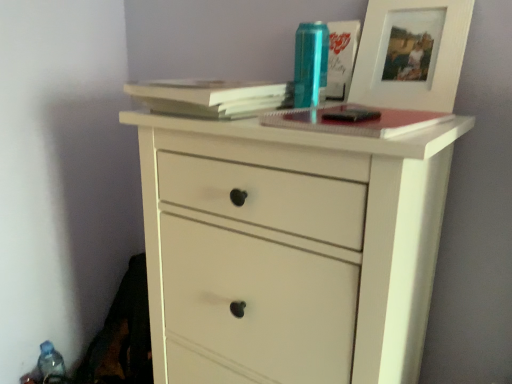
Question: Is light brown paper at upper center, positioned as the 2th paperback book in right-to-left order, not within white matte chest of drawers at center?

Choices:
 (A) no
 (B) yes

Answer: (B)

Question: Can you confirm if light brown paper at upper center, positioned as the 1th paperback book in left-to-right order, is smaller than white matte chest of drawers at center?

Choices:
 (A) yes
 (B) no

Answer: (A)

Question: Is light brown paper at upper center, positioned as the 2th paperback book in right-to-left order, at the right side of white matte chest of drawers at center?

Choices:
 (A) yes
 (B) no

Answer: (B)

Question: From the image's perspective, is light brown paper at upper center, positioned as the 1th paperback book in left-to-right order, located above white matte chest of drawers at center?

Choices:
 (A) yes
 (B) no

Answer: (A)

Question: Considering the relative sizes of light brown paper at upper center, positioned as the 2th paperback book in right-to-left order, and white matte chest of drawers at center in the image provided, is light brown paper at upper center, positioned as the 2th paperback book in right-to-left order, thinner than white matte chest of drawers at center?

Choices:
 (A) no
 (B) yes

Answer: (B)

Question: From the image's perspective, is white matte chest of drawers at center positioned above or below hardcover notebook at center, the first paperback book from the right?

Choices:
 (A) below
 (B) above

Answer: (A)

Question: From a real-world perspective, is white matte chest of drawers at center positioned above or below hardcover notebook at center, the first paperback book from the right?

Choices:
 (A) above
 (B) below

Answer: (B)

Question: Considering the positions of white matte chest of drawers at center and hardcover notebook at center, which ranks as the 2th paperback book in left-to-right order, in the image, is white matte chest of drawers at center wider or thinner than hardcover notebook at center, which ranks as the 2th paperback book in left-to-right order,?

Choices:
 (A) thin
 (B) wide

Answer: (B)

Question: In the image, is white matte chest of drawers at center on the left side or the right side of hardcover notebook at center, which ranks as the 2th paperback book in left-to-right order?

Choices:
 (A) left
 (B) right

Answer: (A)

Question: From the image's perspective, is light brown paper at upper center, positioned as the 2th paperback book in right-to-left order, above or below blue plastic bottle at lower left, placed as the 2th bottle when sorted from top to bottom?

Choices:
 (A) below
 (B) above

Answer: (B)

Question: In the image, is light brown paper at upper center, positioned as the 2th paperback book in right-to-left order, positioned in front of or behind blue plastic bottle at lower left, the first bottle from the left?

Choices:
 (A) behind
 (B) front

Answer: (B)

Question: Looking at the image, does light brown paper at upper center, positioned as the 2th paperback book in right-to-left order, seem bigger or smaller compared to blue plastic bottle at lower left, placed as the 2th bottle when sorted from top to bottom?

Choices:
 (A) big
 (B) small

Answer: (A)

Question: Would you say light brown paper at upper center, positioned as the 1th paperback book in left-to-right order, is to the left or to the right of blue plastic bottle at lower left, the second bottle when ordered from right to left, in the picture?

Choices:
 (A) left
 (B) right

Answer: (B)

Question: Considering the relative positions of blue plastic bottle at lower left, arranged as the second bottle when viewed from the front, and white wood picture frame at upper right in the image provided, is blue plastic bottle at lower left, arranged as the second bottle when viewed from the front, to the left or to the right of white wood picture frame at upper right?

Choices:
 (A) left
 (B) right

Answer: (A)

Question: From the image's perspective, is blue plastic bottle at lower left, arranged as the second bottle when viewed from the front, located above or below white wood picture frame at upper right?

Choices:
 (A) below
 (B) above

Answer: (A)